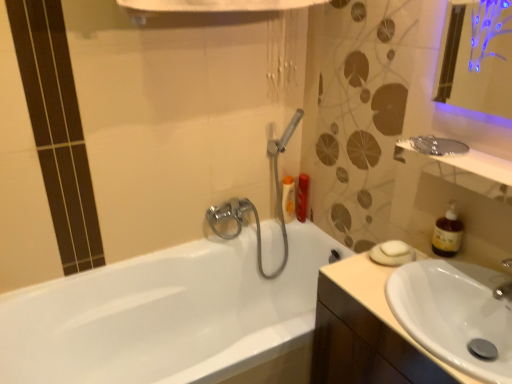
The image size is (512, 384). Describe the element at coordinates (474, 173) in the screenshot. I see `metallic silver mirror at upper right` at that location.

Locate an element on the screen. white glossy sink at lower right is located at coordinates (454, 313).

What do you see at coordinates (454, 313) in the screenshot? I see `white glossy sink at lower right` at bounding box center [454, 313].

Where is `white matte soap at right`? The height and width of the screenshot is (384, 512). white matte soap at right is located at coordinates (394, 248).

Measure the distance between point (340,382) and camera.

Point (340,382) and camera are 1.25 meters apart from each other.

The image size is (512, 384). What do you see at coordinates (447, 233) in the screenshot?
I see `brown translucent soap dispenser at right` at bounding box center [447, 233].

Where is `metallic silver mirror at upper right`? metallic silver mirror at upper right is located at coordinates (474, 173).

In the scene shown: From a real-world perspective, who is located higher, brown translucent soap dispenser at right or white matte soap at right?

brown translucent soap dispenser at right, from a real-world perspective.

Is white matte soap at right located within brown translucent soap dispenser at right?

No, white matte soap at right is located outside of brown translucent soap dispenser at right.

You are a GUI agent. You are given a task and a screenshot of the screen. Output one action in this format:
    pyautogui.click(x=<x>, y=<y>)
    Task: Click on the soap behind the brown translucent soap dispenser at right
    
    Given the screenshot: What is the action you would take?
    pyautogui.click(x=394, y=248)

Is white matte soap at right at the back of brown translucent soap dispenser at right?

No, brown translucent soap dispenser at right's orientation is not away from white matte soap at right.

In the image, is beige wood cabinet at lower right on the left side or the right side of matte plastic shampoo bottle at upper right, which appears as the 1th toiletry when viewed from the right?

beige wood cabinet at lower right is positioned on matte plastic shampoo bottle at upper right, which appears as the 1th toiletry when viewed from the right,'s right side.

Considering the sizes of beige wood cabinet at lower right and matte plastic shampoo bottle at upper right, which appears as the 1th toiletry when viewed from the right, in the image, is beige wood cabinet at lower right bigger or smaller than matte plastic shampoo bottle at upper right, which appears as the 1th toiletry when viewed from the right,?

Clearly, beige wood cabinet at lower right is larger in size than matte plastic shampoo bottle at upper right, which appears as the 1th toiletry when viewed from the right.

Which object is closer to the camera, beige wood cabinet at lower right or matte plastic shampoo bottle at upper right, marked as the 2th toiletry in a left-to-right arrangement?

beige wood cabinet at lower right.

Is point (456, 230) positioned behind point (20, 379)?

No, (456, 230) is closer to viewer.

Looking at the image, does brown translucent soap dispenser at right seem bigger or smaller compared to white glossy bathtub at center?

Considering their sizes, brown translucent soap dispenser at right takes up less space than white glossy bathtub at center.

Can you confirm if brown translucent soap dispenser at right is shorter than white glossy bathtub at center?

Yes.

From the image's perspective, is brown translucent soap dispenser at right located above white glossy bathtub at center?

Yes, from the image's perspective, brown translucent soap dispenser at right is on top of white glossy bathtub at center.

From the picture: Which of these two, brown translucent soap dispenser at right or metallic silver mirror at upper right, is wider?

metallic silver mirror at upper right.

Choose the correct answer: Is brown translucent soap dispenser at right inside metallic silver mirror at upper right or outside it?

brown translucent soap dispenser at right is spatially situated outside metallic silver mirror at upper right.

Visually, is brown translucent soap dispenser at right positioned to the left or to the right of metallic silver mirror at upper right?

From the image, it's evident that brown translucent soap dispenser at right is to the right of metallic silver mirror at upper right.

Is point (453, 216) positioned after point (481, 192)?

That is True.

Is point (69, 294) farther from viewer compared to point (400, 245)?

Yes, it is behind point (400, 245).

Looking at this image, considering the sizes of white glossy bathtub at center and white matte soap at right in the image, is white glossy bathtub at center taller or shorter than white matte soap at right?

Considering their sizes, white glossy bathtub at center has more height than white matte soap at right.

Is white glossy bathtub at center with white matte soap at right?

No, white glossy bathtub at center is not making contact with white matte soap at right.

Considering the relative sizes of white glossy bathtub at center and white matte soap at right in the image provided, is white glossy bathtub at center wider than white matte soap at right?

Correct, the width of white glossy bathtub at center exceeds that of white matte soap at right.

Is matte plastic shampoo bottle at upper right, marked as the 2th toiletry in a left-to-right arrangement, to the right of orange matte bottle at upper right, the first toiletry when ordered from left to right, from the viewer's perspective?

Correct, you'll find matte plastic shampoo bottle at upper right, marked as the 2th toiletry in a left-to-right arrangement, to the right of orange matte bottle at upper right, the first toiletry when ordered from left to right.

Could orange matte bottle at upper right, which appears as the second toiletry when viewed from the right, be considered to be inside matte plastic shampoo bottle at upper right, marked as the 2th toiletry in a left-to-right arrangement?

That's incorrect, orange matte bottle at upper right, which appears as the second toiletry when viewed from the right, is not inside matte plastic shampoo bottle at upper right, marked as the 2th toiletry in a left-to-right arrangement.

From a real-world perspective, who is located higher, matte plastic shampoo bottle at upper right, marked as the 2th toiletry in a left-to-right arrangement, or orange matte bottle at upper right, the first toiletry when ordered from left to right?

orange matte bottle at upper right, the first toiletry when ordered from left to right.

Is point (305, 209) closer to viewer compared to point (293, 204)?

That is True.

Is orange matte bottle at upper right, which appears as the second toiletry when viewed from the right, facing away from white matte soap at right?

orange matte bottle at upper right, which appears as the second toiletry when viewed from the right, is not turned away from white matte soap at right.

From the image's perspective, does orange matte bottle at upper right, the first toiletry when ordered from left to right, appear higher than white matte soap at right?

Yes, from the image's perspective, orange matte bottle at upper right, the first toiletry when ordered from left to right, is over white matte soap at right.

Who is more distant, orange matte bottle at upper right, which appears as the second toiletry when viewed from the right, or white matte soap at right?

Positioned behind is orange matte bottle at upper right, which appears as the second toiletry when viewed from the right.

Where is `soap below the brown translucent soap dispenser at right (from a real-world perspective)`? soap below the brown translucent soap dispenser at right (from a real-world perspective) is located at coordinates (394, 248).

Identify the location of cabinetry that is below the matte plastic shampoo bottle at upper right, marked as the 2th toiletry in a left-to-right arrangement (from the image's perspective). point(362,346).

Estimate the real-world distances between objects in this image. Which object is further from white glossy bathtub at center, beige wood cabinet at lower right or metallic silver mirror at upper right?

metallic silver mirror at upper right.

Looking at the image, which one is located closer to orange matte bottle at upper right, the first toiletry when ordered from left to right, brown translucent soap dispenser at right or white matte soap at right?

white matte soap at right is positioned closer to the anchor orange matte bottle at upper right, the first toiletry when ordered from left to right.

From the image, which object appears to be farther from white glossy sink at lower right, matte plastic shampoo bottle at upper right, which appears as the 1th toiletry when viewed from the right, or brown translucent soap dispenser at right?

Based on the image, matte plastic shampoo bottle at upper right, which appears as the 1th toiletry when viewed from the right, appears to be further to white glossy sink at lower right.

Which object lies nearer to the anchor point brown translucent soap dispenser at right, orange matte bottle at upper right, the first toiletry when ordered from left to right, or white glossy sink at lower right?

Based on the image, white glossy sink at lower right appears to be nearer to brown translucent soap dispenser at right.

Estimate the real-world distances between objects in this image. Which object is further from white glossy sink at lower right, metallic silver mirror at upper right or beige wood cabinet at lower right?

metallic silver mirror at upper right is further to white glossy sink at lower right.

Considering their positions, is white glossy sink at lower right positioned further to white matte soap at right than matte plastic shampoo bottle at upper right, marked as the 2th toiletry in a left-to-right arrangement?

Based on the image, matte plastic shampoo bottle at upper right, marked as the 2th toiletry in a left-to-right arrangement, appears to be further to white matte soap at right.

Based on their spatial positions, is white glossy bathtub at center or white matte soap at right further from beige wood cabinet at lower right?

white glossy bathtub at center is positioned further to the anchor beige wood cabinet at lower right.

Estimate the real-world distances between objects in this image. Which object is further from white glossy sink at lower right, white glossy bathtub at center or matte plastic shampoo bottle at upper right, which appears as the 1th toiletry when viewed from the right?

Among the two, matte plastic shampoo bottle at upper right, which appears as the 1th toiletry when viewed from the right, is located further to white glossy sink at lower right.

Where is `toiletry between white matte soap at right and matte plastic shampoo bottle at upper right, which appears as the 1th toiletry when viewed from the right, along the z-axis`? This screenshot has width=512, height=384. toiletry between white matte soap at right and matte plastic shampoo bottle at upper right, which appears as the 1th toiletry when viewed from the right, along the z-axis is located at coordinates (288, 199).

At what (x,y) coordinates should I click in order to perform the action: click on bathtub between beige wood cabinet at lower right and matte plastic shampoo bottle at upper right, which appears as the 1th toiletry when viewed from the right, along the z-axis. Please return your answer as a coordinate pair (x, y). Image resolution: width=512 pixels, height=384 pixels. Looking at the image, I should click on (165, 314).

Identify the location of soap between white glossy bathtub at center and matte plastic shampoo bottle at upper right, marked as the 2th toiletry in a left-to-right arrangement, along the z-axis. (394, 248).

Image resolution: width=512 pixels, height=384 pixels. I want to click on soap located between white glossy sink at lower right and orange matte bottle at upper right, which appears as the second toiletry when viewed from the right, in the depth direction, so click(x=394, y=248).